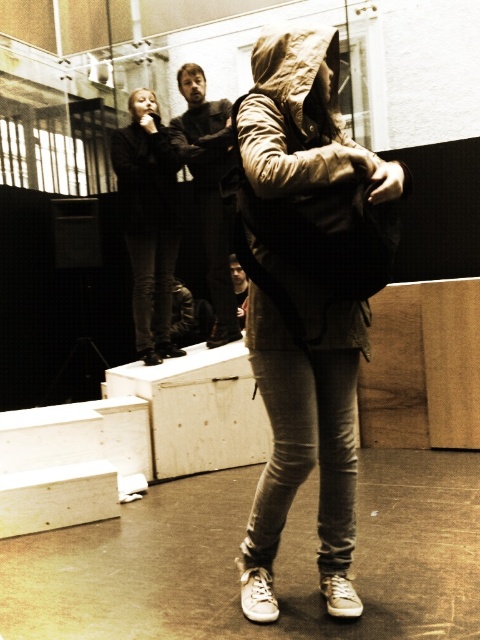
You are a photographer positioned in the studio and want to capture a closeup of the black leather jacket at upper left without the dark gray hoodie at upper left appearing in the frame. Is this possible based on their positions?

The black leather jacket at upper left is further to the viewer than the dark gray hoodie at upper left, so yes, you can focus on the black leather jacket at upper left and exclude the dark gray hoodie at upper left from the frame by adjusting the camera angle or zoom.